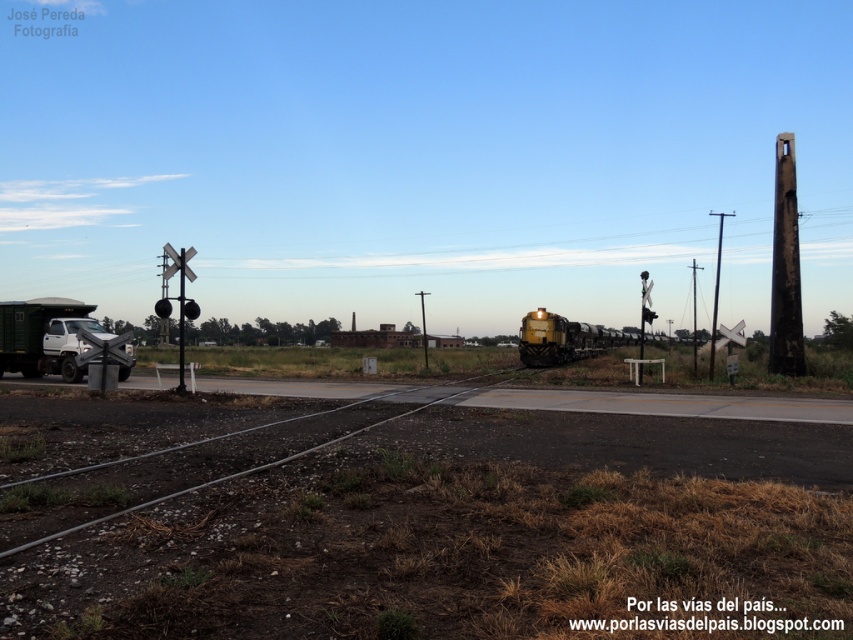
Question: Is charcoal textured pole at right wider than brown wooden telegraph pole at center-right?

Choices:
 (A) yes
 (B) no

Answer: (B)

Question: Which is farther from the brown wooden telegraph pole at center?

Choices:
 (A) brushed metal pole at left
 (B) brown wooden telegraph pole at right
 (C) yellow polished metal train at center

Answer: (B)

Question: Is brown wooden telegraph pole at right to the right of brown wooden telegraph pole at center-right from the viewer's perspective?

Choices:
 (A) no
 (B) yes

Answer: (B)

Question: Which point is closer to the camera?

Choices:
 (A) charcoal textured pole at right
 (B) brown wooden telegraph pole at center-right
 (C) brushed metal pole at left
 (D) brown wooden telegraph pole at center

Answer: (C)

Question: Which point appears farthest from the camera in this image?

Choices:
 (A) (181, 305)
 (B) (614, 332)

Answer: (B)

Question: Can you confirm if brushed metal pole at left is bigger than brown wooden telegraph pole at right?

Choices:
 (A) yes
 (B) no

Answer: (B)